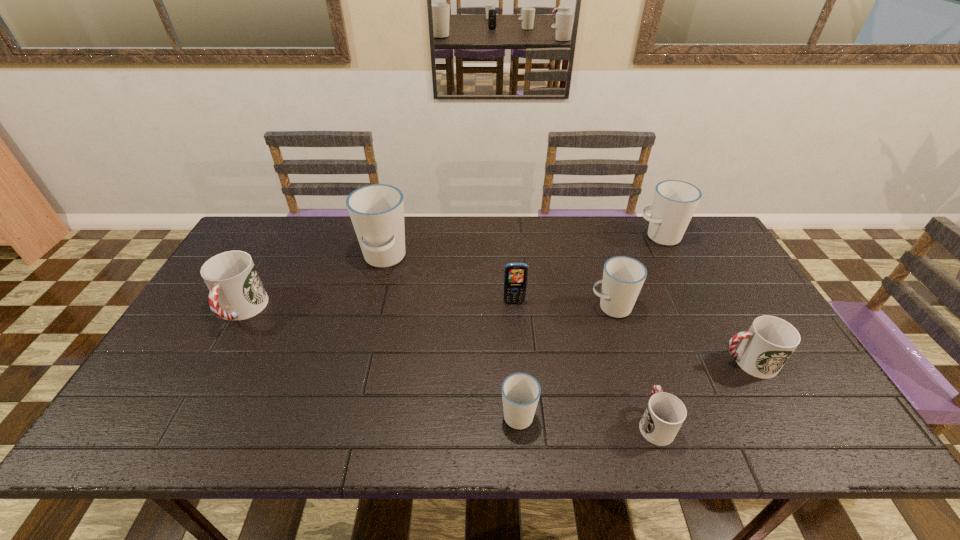
Where is `the biggest white cup`? The image size is (960, 540). the biggest white cup is located at coordinates (377, 211).

Locate an element on the screen. the tallest object is located at coordinates (377, 211).

You are a GUI agent. You are given a task and a screenshot of the screen. Output one action in this format:
    pyautogui.click(x=<x>, y=<y>)
    Task: Click on the second biggest white cup
    This screenshot has height=540, width=960.
    Given the screenshot: What is the action you would take?
    (675, 201)

What are the coordinates of `the rightmost white cup` in the screenshot? It's located at (675, 201).

Locate an element on the screen. This screenshot has height=540, width=960. the leftmost red cup is located at coordinates (236, 291).

Locate an element on the screen. The height and width of the screenshot is (540, 960). the leftmost object is located at coordinates (236, 291).

Where is `cellular telephone`? The image size is (960, 540). cellular telephone is located at coordinates (515, 275).

You are a GUI agent. You are given a task and a screenshot of the screen. Output one action in this format:
    pyautogui.click(x=<x>, y=<y>)
    Task: Click on the third biggest white cup
    Image resolution: width=960 pixels, height=540 pixels.
    Given the screenshot: What is the action you would take?
    pyautogui.click(x=623, y=277)

You are a GUI agent. You are given a task and a screenshot of the screen. Output one action in this format:
    pyautogui.click(x=<x>, y=<y>)
    Task: Click on the second nearest white cup
    
    Given the screenshot: What is the action you would take?
    pyautogui.click(x=623, y=277)

Where is `the sixth farthest object`? the sixth farthest object is located at coordinates [766, 346].